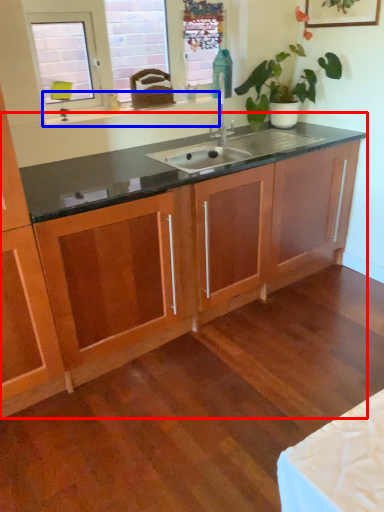
Question: Which object appears closest to the camera in this image, dresser (highlighted by a red box) or window sill (highlighted by a blue box)?

Choices:
 (A) dresser
 (B) window sill

Answer: (A)